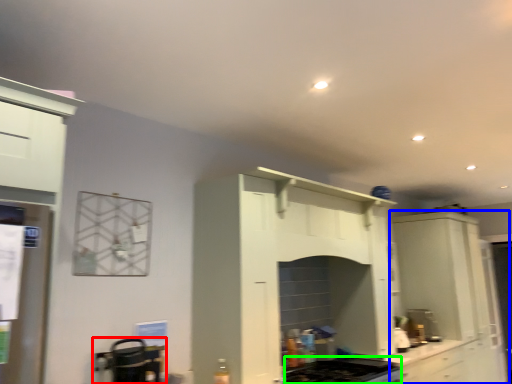
Question: Which object is positioned farthest from appliance (highlighted by a red box)? Select from cabinetry (highlighted by a blue box) and gas stove (highlighted by a green box).

Choices:
 (A) cabinetry
 (B) gas stove

Answer: (A)